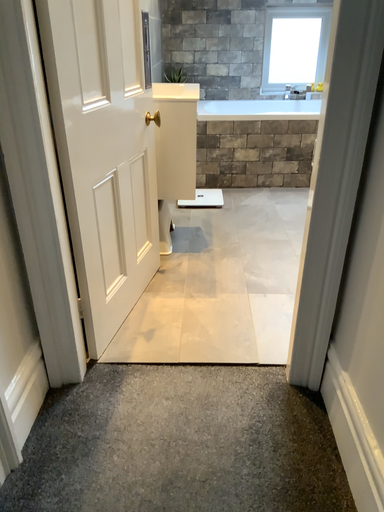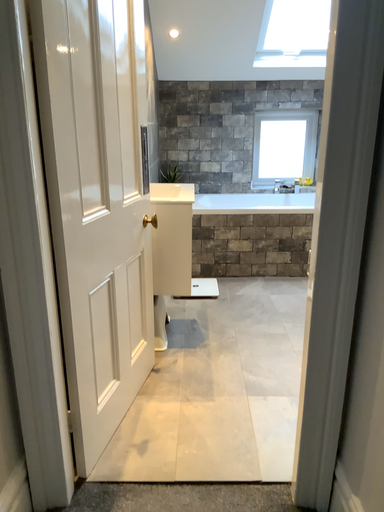
Question: How did the camera likely rotate when shooting the video?

Choices:
 (A) rotated downward
 (B) rotated upward

Answer: (B)